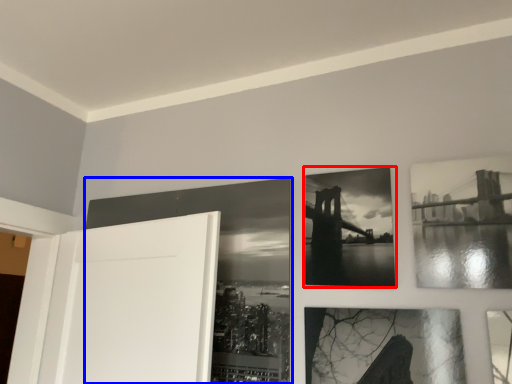
Question: Which object is further to the camera taking this photo, picture frame (highlighted by a red box) or picture frame (highlighted by a blue box)?

Choices:
 (A) picture frame
 (B) picture frame

Answer: (B)